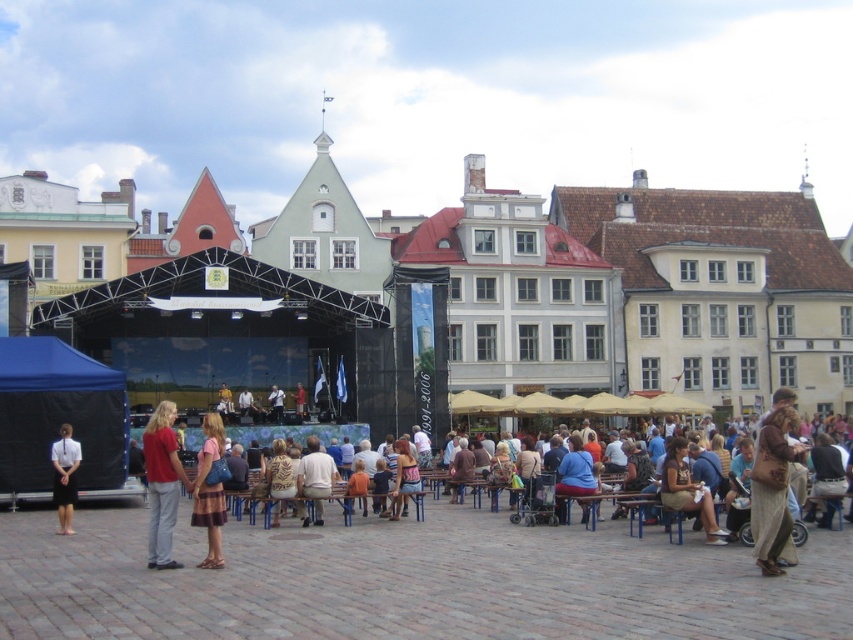
Is black matte stage at center wider than striped fabric skirt at lower left?

Indeed, black matte stage at center has a greater width compared to striped fabric skirt at lower left.

Between point (399, 230) and point (213, 438), which one is positioned behind?

The point (399, 230) is more distant.

The image size is (853, 640). What do you see at coordinates (602, 282) in the screenshot? I see `black matte stage at center` at bounding box center [602, 282].

Where is `black matte stage at center`? This screenshot has height=640, width=853. black matte stage at center is located at coordinates (602, 282).

What do you see at coordinates (161, 483) in the screenshot? I see `red cotton shirt at center` at bounding box center [161, 483].

Consider the image. Does red cotton shirt at center have a greater width compared to striped fabric skirt at lower left?

Yes.

Is point (169, 445) farther from viewer compared to point (212, 536)?

Yes, it is behind point (212, 536).

Locate an element on the screen. The height and width of the screenshot is (640, 853). red cotton shirt at center is located at coordinates (161, 483).

Where is `red cotton shirt at center`? Image resolution: width=853 pixels, height=640 pixels. red cotton shirt at center is located at coordinates (161, 483).

Consider the image. Is red cotton shirt at center smaller than brown leather bag at lower right?

Incorrect, red cotton shirt at center is not smaller in size than brown leather bag at lower right.

Does point (167, 525) come behind point (706, 536)?

No.

Where is `red cotton shirt at center`? This screenshot has height=640, width=853. red cotton shirt at center is located at coordinates (161, 483).